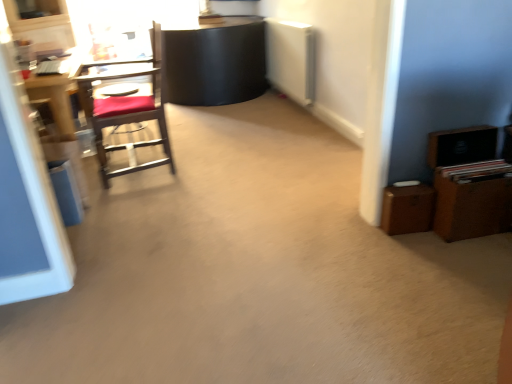
Locate an element on the screen. The width and height of the screenshot is (512, 384). free space in front of brown wooden dresser at right is located at coordinates (472, 262).